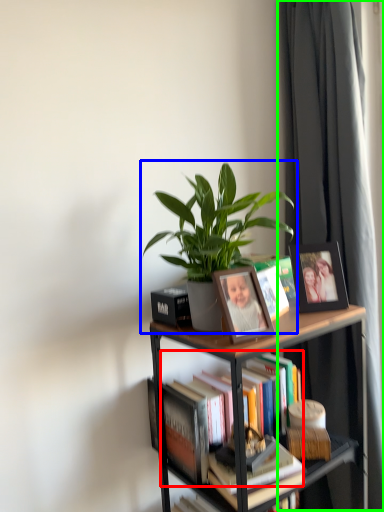
Question: Based on their relative distances, which object is nearer to book (highlighted by a red box)? Choose from houseplant (highlighted by a blue box) and curtain (highlighted by a green box).

Choices:
 (A) houseplant
 (B) curtain

Answer: (A)